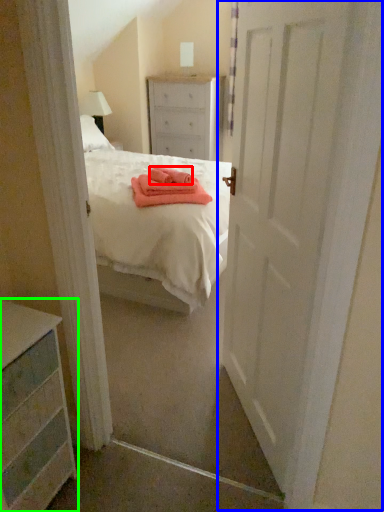
Question: Which object is positioned closest to cloth (highlighted by a red box)? Select from door (highlighted by a blue box) and chest of drawers (highlighted by a green box).

Choices:
 (A) door
 (B) chest of drawers

Answer: (A)